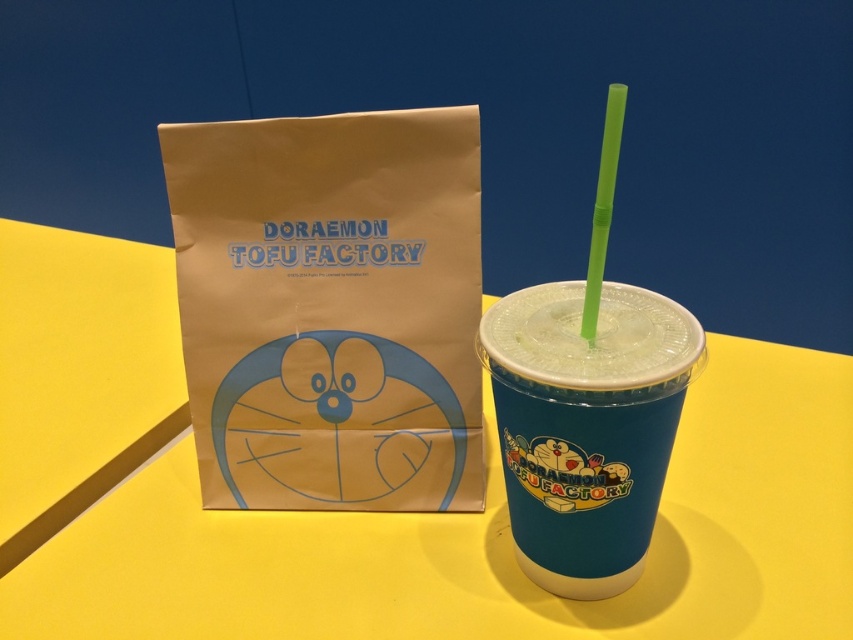
Question: Which object is farther from the camera taking this photo?

Choices:
 (A) green plastic straw at upper right
 (B) blue plastic cup at center
 (C) blue plastic cup at right
 (D) yellow matte table at center

Answer: (D)

Question: Observing the image, what is the correct spatial positioning of yellow matte table at center in reference to brown paper bag at center?

Choices:
 (A) below
 (B) above

Answer: (A)

Question: Which is farther from the green plastic straw at upper right?

Choices:
 (A) blue plastic cup at right
 (B) brown paper bag at center

Answer: (B)

Question: Which point is farther to the camera?

Choices:
 (A) brown paper bag at center
 (B) yellow matte table at center
 (C) green plastic straw at upper right
 (D) blue plastic cup at center

Answer: (A)

Question: Can you confirm if brown paper bag at center is smaller than blue plastic cup at right?

Choices:
 (A) no
 (B) yes

Answer: (A)

Question: Considering the relative positions of brown paper bag at center and blue plastic cup at center in the image provided, where is brown paper bag at center located with respect to blue plastic cup at center?

Choices:
 (A) left
 (B) right

Answer: (A)